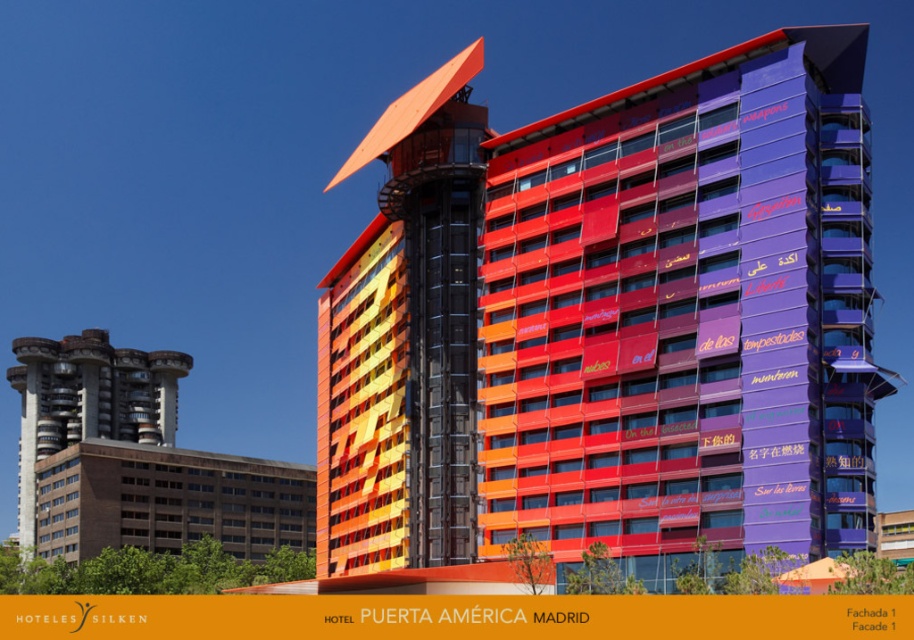
You are standing in front of the Hotel Puerta America Madrid and want to take a photo of the multicolored glass elevator at center and the brown brick building at lower left. Which object appears narrower in the photo?

The multicolored glass elevator at center appears narrower than the brown brick building at lower left in the photo.

You are standing in front of the Hotel Puerta America Madrid and notice two buildings nearby. The first is a brown brick building at lower left, and the second is a brown concrete building at left. Based on their sizes, which one is closer to you?

The brown brick building at lower left is smaller in size compared to the brown concrete building at left, so it is farther away from you.

You are standing at point (677,308) in the image of the Hotel Puerta America Madrid. What can you see directly in front of you?

At point (677,308), you can see the multicolored glass building at center directly in front of you.